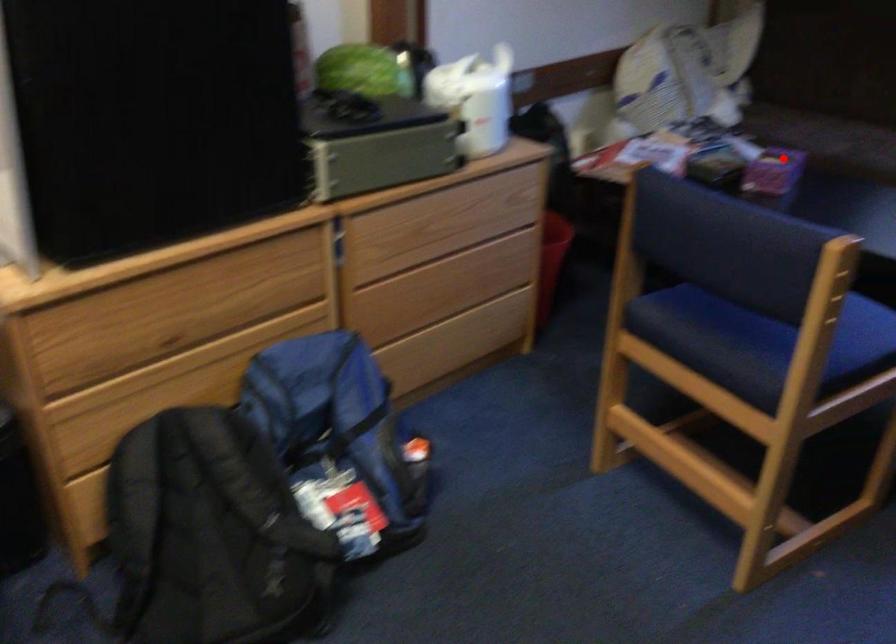
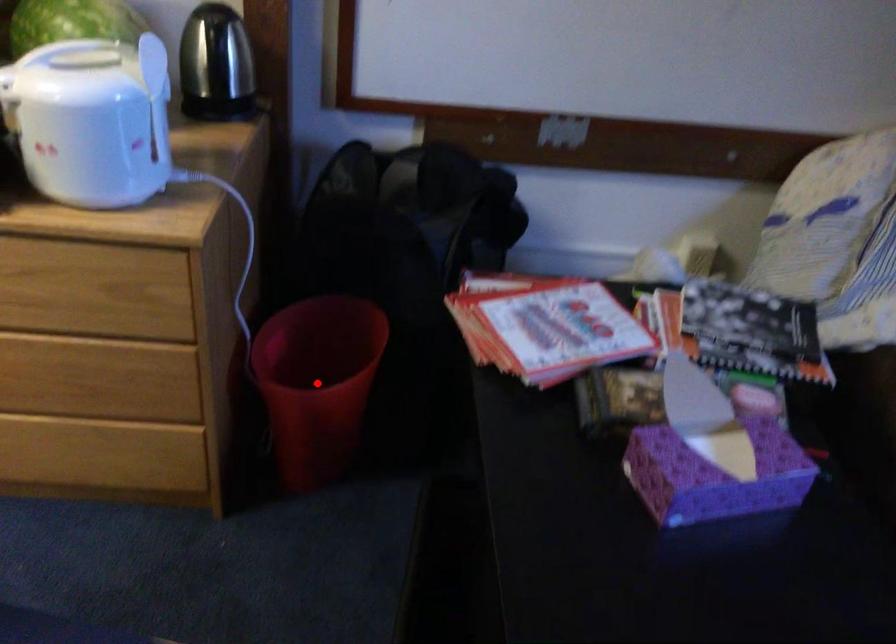
Consider the image. I am providing you with two images of the same scene from different viewpoints. A red point is marked on the first image and another point is marked on the second image. Is the marked point in image1 the same physical position as the marked point in image2?

No